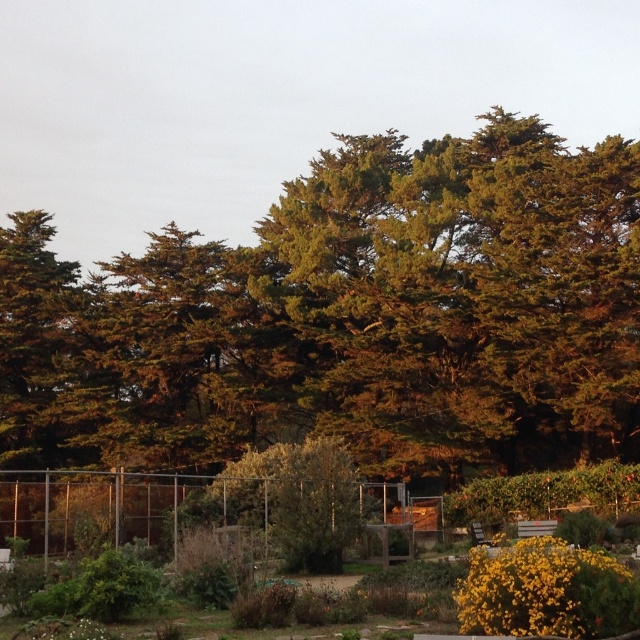
Question: Which of the following is the farthest from the observer?

Choices:
 (A) (3, 381)
 (B) (528, 532)
 (C) (570, 611)

Answer: (A)

Question: Does green leafy bush at center lie in front of wooden bench at lower right?

Choices:
 (A) yes
 (B) no

Answer: (A)

Question: In this image, where is green textured tree at center located relative to wooden bench at lower right?

Choices:
 (A) right
 (B) left

Answer: (B)

Question: Among these objects, which one is farthest from the camera?

Choices:
 (A) wooden bench at lower right
 (B) green textured tree at center
 (C) green leafy bush at center

Answer: (B)

Question: In this image, where is green textured tree at center located relative to wooden bench at lower right?

Choices:
 (A) above
 (B) below

Answer: (A)

Question: Among these objects, which one is nearest to the camera?

Choices:
 (A) wooden bench at lower right
 (B) green textured tree at center

Answer: (A)